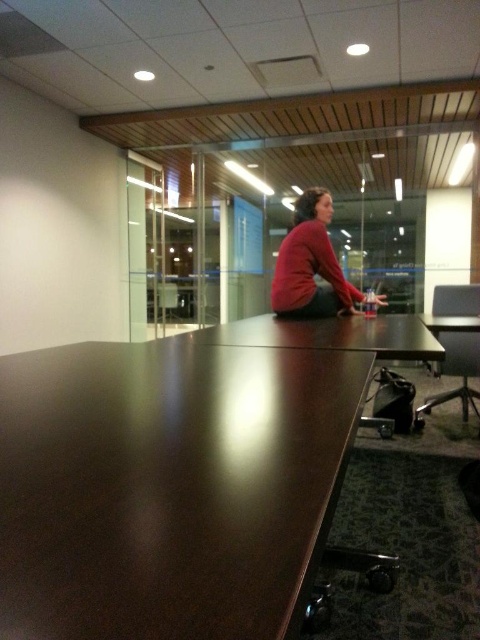
Question: Does matte red sweater at center have a larger size compared to matte brown table at lower right?

Choices:
 (A) no
 (B) yes

Answer: (A)

Question: Can you confirm if glossy wood table at center is positioned below matte brown table at lower right?

Choices:
 (A) no
 (B) yes

Answer: (A)

Question: Which of the following is the closest to the observer?

Choices:
 (A) glossy wood table at center
 (B) matte red sweater at center

Answer: (A)

Question: Which point appears farthest from the camera in this image?

Choices:
 (A) (470, 364)
 (B) (319, 189)

Answer: (A)

Question: Which of these objects is positioned closest to the matte red sweater at center?

Choices:
 (A) matte brown table at lower right
 (B) glossy wood table at center

Answer: (A)

Question: Does glossy wood table at center appear on the right side of matte brown table at lower right?

Choices:
 (A) yes
 (B) no

Answer: (B)